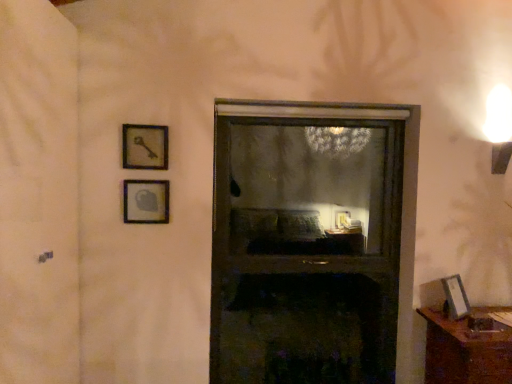
Question: Can you confirm if wooden key at upper left, marked as the second picture frame in a left-to-right arrangement, is positioned to the right of matte glass picture frame at upper left, which is counted as the 1th picture frame, starting from the left?

Choices:
 (A) no
 (B) yes

Answer: (B)

Question: Is wooden key at upper left, marked as the second picture frame in a left-to-right arrangement, thinner than matte glass picture frame at upper left, which is counted as the 1th picture frame, starting from the left?

Choices:
 (A) no
 (B) yes

Answer: (A)

Question: Can you confirm if wooden key at upper left, marked as the second picture frame in a left-to-right arrangement, is wider than matte glass picture frame at upper left, acting as the third picture frame starting from the right?

Choices:
 (A) no
 (B) yes

Answer: (B)

Question: Would you say wooden key at upper left, marked as the second picture frame in a left-to-right arrangement, is a long distance from matte glass picture frame at upper left, acting as the third picture frame starting from the right?

Choices:
 (A) no
 (B) yes

Answer: (A)

Question: Does wooden key at upper left, which is the first picture frame from top to bottom, have a smaller size compared to matte glass picture frame at upper left, which appears as the 2th picture frame when ordered from the bottom?

Choices:
 (A) no
 (B) yes

Answer: (A)

Question: Considering the positions of point (75, 291) and point (142, 147), is point (75, 291) closer or farther from the camera than point (142, 147)?

Choices:
 (A) closer
 (B) farther

Answer: (A)

Question: Would you say transparent plastic screen door at left is inside or outside wooden key at upper left, arranged as the third picture frame when ordered from the bottom?

Choices:
 (A) outside
 (B) inside

Answer: (A)

Question: Is transparent plastic screen door at left bigger or smaller than wooden key at upper left, which is the first picture frame from top to bottom?

Choices:
 (A) big
 (B) small

Answer: (A)

Question: From a real-world perspective, is transparent plastic screen door at left physically located above or below wooden key at upper left, which is the first picture frame from top to bottom?

Choices:
 (A) above
 (B) below

Answer: (B)

Question: From a real-world perspective, is brown wooden table at lower right physically located above or below matte silver picture frame at lower right, marked as the 1th picture frame in a right-to-left arrangement?

Choices:
 (A) above
 (B) below

Answer: (B)

Question: Visually, is brown wooden table at lower right positioned to the left or to the right of matte silver picture frame at lower right, marked as the 1th picture frame in a right-to-left arrangement?

Choices:
 (A) left
 (B) right

Answer: (B)

Question: Considering the positions of point (426, 382) and point (454, 301), is point (426, 382) closer or farther from the camera than point (454, 301)?

Choices:
 (A) closer
 (B) farther

Answer: (B)

Question: Looking at the image, does brown wooden table at lower right seem bigger or smaller compared to matte silver picture frame at lower right, marked as the 1th picture frame in a right-to-left arrangement?

Choices:
 (A) big
 (B) small

Answer: (A)

Question: From their relative heights in the image, would you say transparent glass window at center is taller or shorter than wooden key at upper left, marked as the second picture frame in a right-to-left arrangement?

Choices:
 (A) tall
 (B) short

Answer: (A)

Question: From a real-world perspective, relative to wooden key at upper left, marked as the second picture frame in a right-to-left arrangement, is transparent glass window at center vertically above or below?

Choices:
 (A) above
 (B) below

Answer: (B)